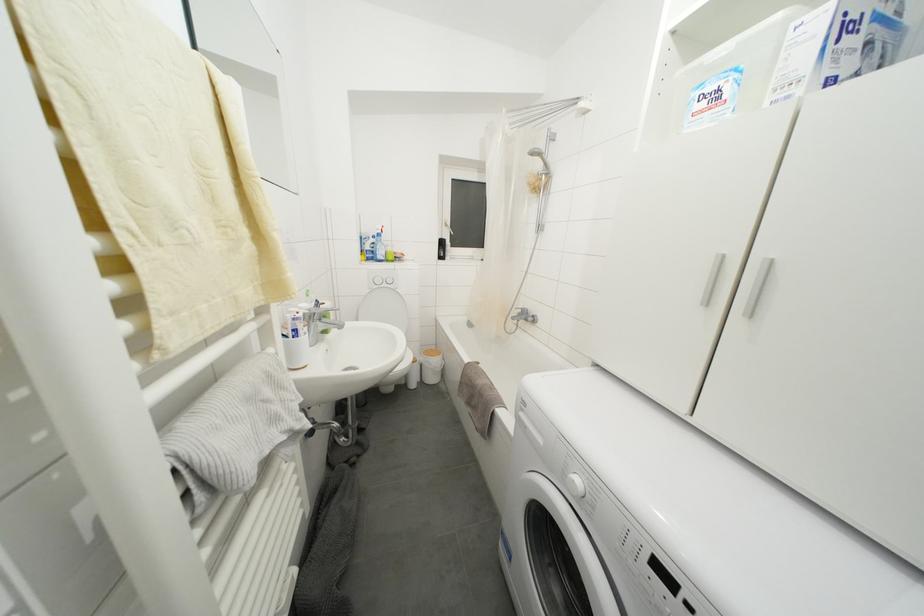
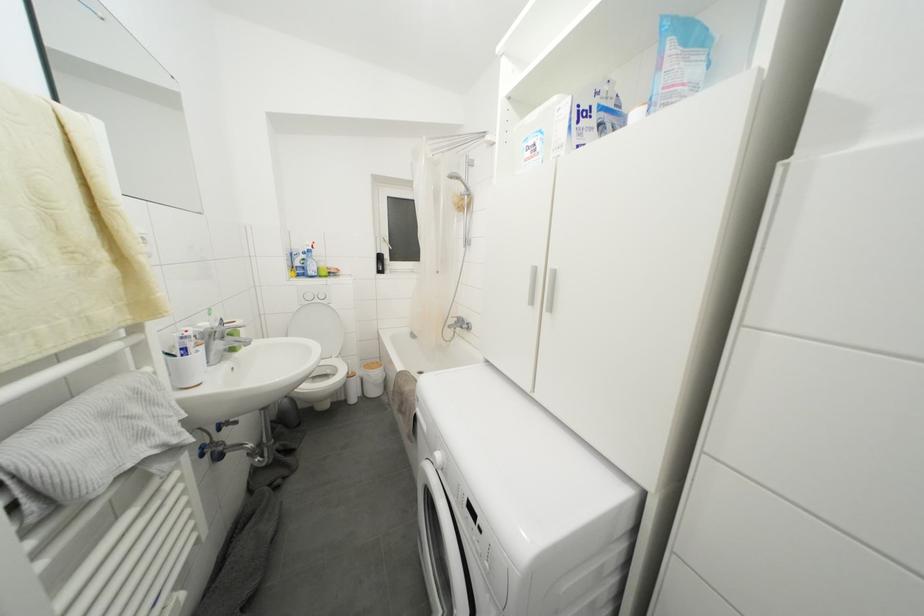
The point at (581, 487) is marked in the first image. Where is the corresponding point in the second image?

(443, 461)